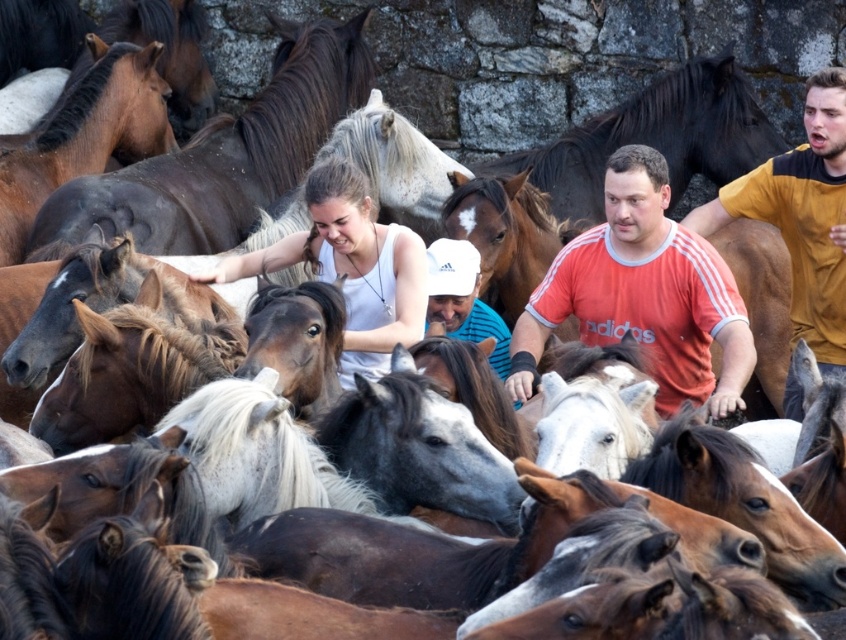
You are a photographer trying to capture a clear shot of both the white matte tank top at center and the white matte cap at center. Since you want to ensure both are visible in your photo, which object should you focus on first considering their sizes?

The white matte tank top at center has a greater height compared to the white matte cap at center, so you should focus on the white matte tank top at center first to ensure it is clearly visible, and then adjust to capture the smaller white matte cap at center.

You are a photographer positioned at the center of the scene. You want to capture a photo that includes both the yellow cotton shirt at right and the white matte cap at center. Which direction should you move to ensure both are in frame?

You should move to the left to include both the yellow cotton shirt at right and the white matte cap at center in your photo, as the yellow cotton shirt at right is located to the right of the white matte cap at center.